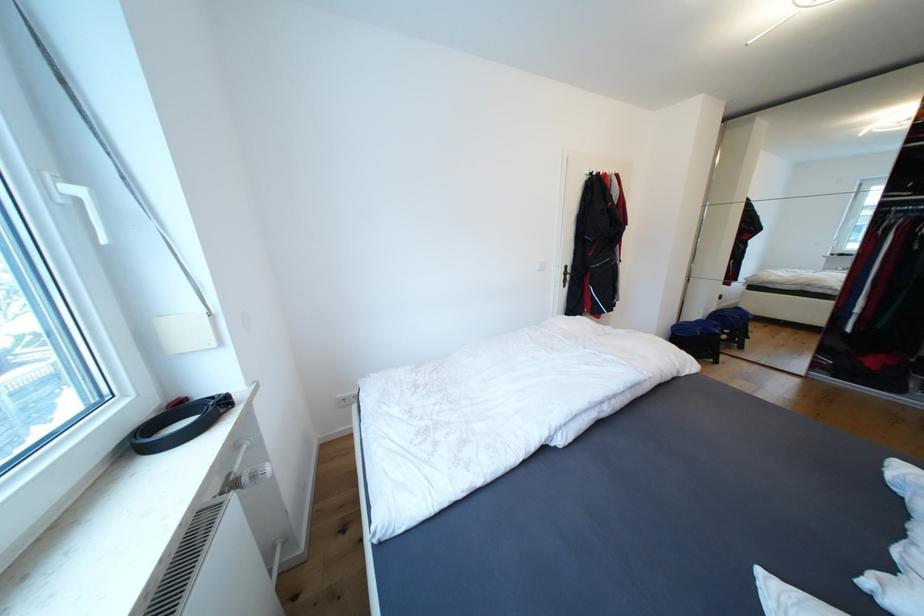
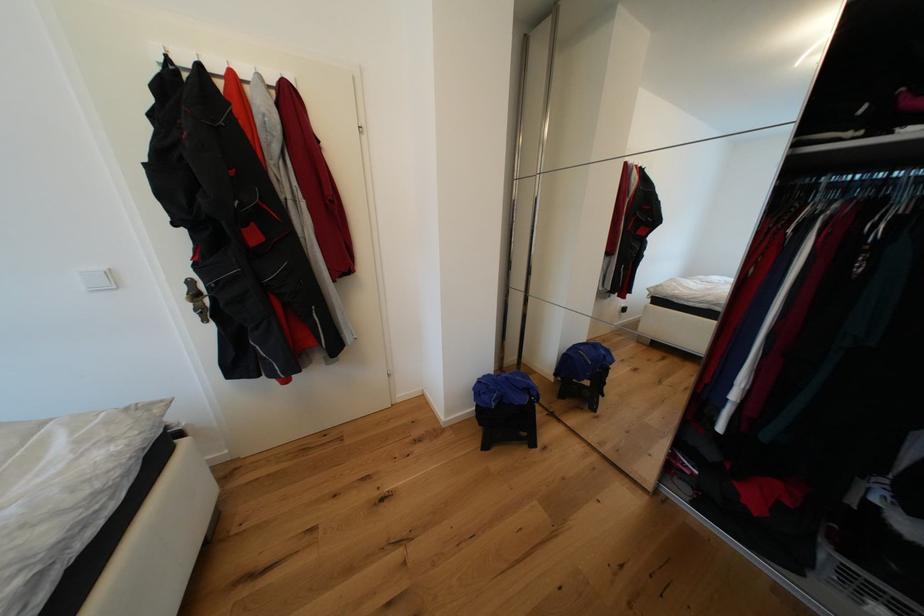
Which direction would the cameraman need to move to produce the second image?

The cameraman moved toward right, forward.